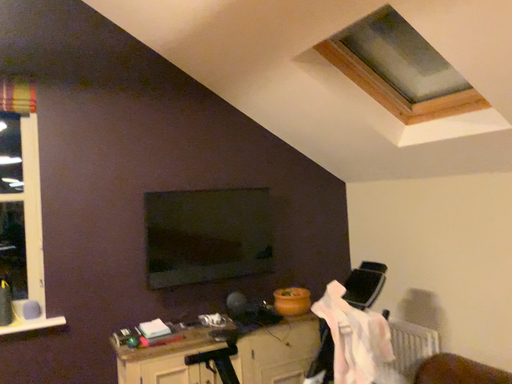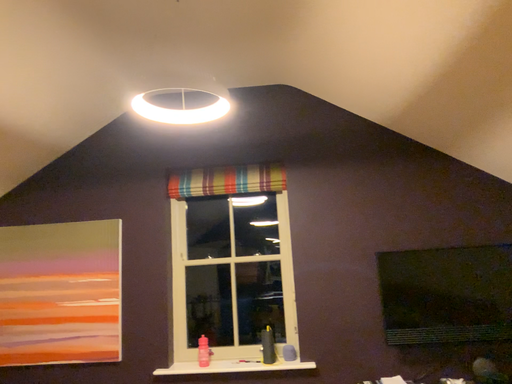
Question: Which way did the camera rotate in the video?

Choices:
 (A) rotated upward
 (B) rotated downward

Answer: (A)